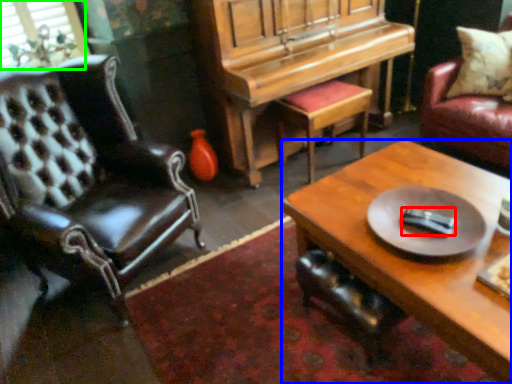
Question: Which is nearer to the remote control (highlighted by a red box)? coffee table (highlighted by a blue box) or window screen (highlighted by a green box).

Choices:
 (A) coffee table
 (B) window screen

Answer: (A)